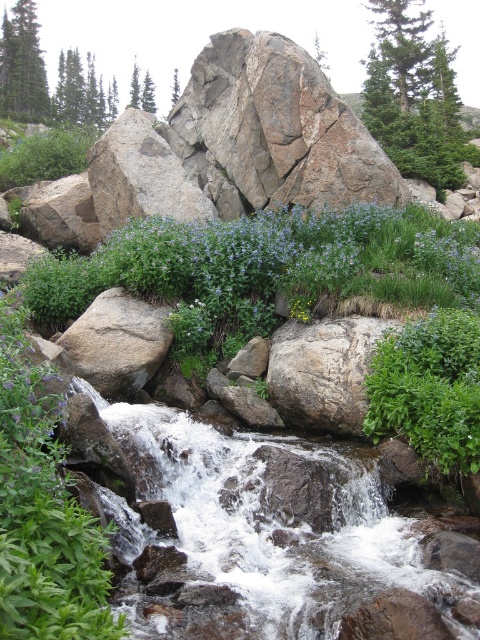
Which is in front, point (58, 522) or point (116, 371)?

Point (58, 522) is more forward.

Where is `green leafy plant at center`? green leafy plant at center is located at coordinates (43, 515).

Where is `green leafy plant at center`? This screenshot has height=640, width=480. green leafy plant at center is located at coordinates (43, 515).

Is blue-green leafy plant at center wider than green matte flower at center?

No, blue-green leafy plant at center is not wider than green matte flower at center.

Between blue-green leafy plant at center and green matte flower at center, which one appears on the left side from the viewer's perspective?

blue-green leafy plant at center

You are a GUI agent. You are given a task and a screenshot of the screen. Output one action in this format:
    pyautogui.click(x=<x>, y=<y>)
    Task: Click on the blue-green leafy plant at center
    
    Given the screenshot: What is the action you would take?
    pyautogui.click(x=263, y=269)

You are a GUI agent. You are given a task and a screenshot of the screen. Output one action in this format:
    pyautogui.click(x=<x>, y=<y>)
    Task: Click on the blue-green leafy plant at center
    This screenshot has height=640, width=480.
    Given the screenshot: What is the action you would take?
    pyautogui.click(x=263, y=269)

Does point (312, 323) lie behind point (100, 381)?

Yes, it is.

Who is taller, rough granite rock at center or gray rough rock at center-left?

gray rough rock at center-left is taller.

Looking at this image, measure the distance between point (x=360, y=372) and camera.

Point (x=360, y=372) is 9.67 meters away from camera.

Identify the location of rough granite rock at center. (323, 371).